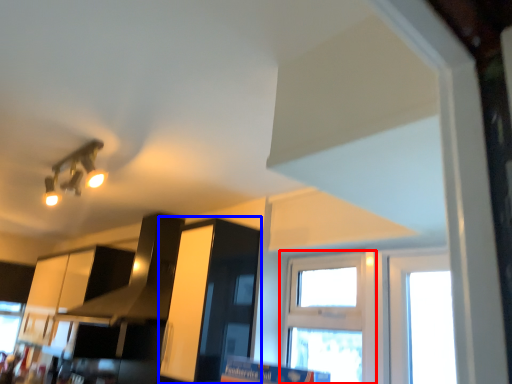
Question: Among these objects, which one is nearest to the camera, window (highlighted by a red box) or cabinetry (highlighted by a blue box)?

Choices:
 (A) window
 (B) cabinetry

Answer: (B)